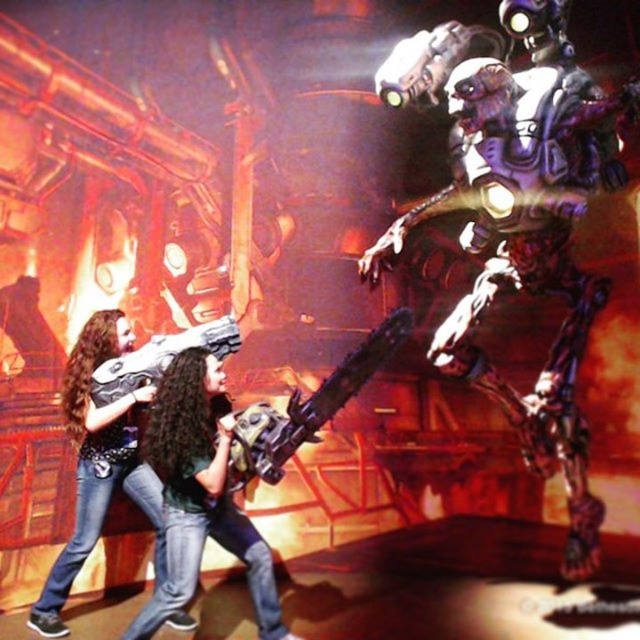
Is point (168, 560) positioned before point (97, 372)?

Yes, it is in front of point (97, 372).

Based on the photo, is matte black chainsaw at center below matte black gun at lower left?

Yes.

The image size is (640, 640). In order to click on matte black chainsaw at center in this screenshot , I will do `click(200, 493)`.

Based on the photo, who is positioned more to the left, matte black guitar at lower left or matte black gun at lower left?

matte black guitar at lower left

Does matte black guitar at lower left appear on the right side of matte black gun at lower left?

No, matte black guitar at lower left is not to the right of matte black gun at lower left.

Which is in front, point (74, 429) or point (140, 365)?

Point (74, 429)

Where is `matte black guitar at lower left`? matte black guitar at lower left is located at coordinates (99, 461).

How much distance is there between metallic chainsaw at center and matte black gun at lower left?

metallic chainsaw at center and matte black gun at lower left are 27.01 inches apart.

Does point (342, 396) come closer to viewer compared to point (141, 384)?

Yes, point (342, 396) is closer to viewer.

Identify the location of metallic chainsaw at center. (307, 406).